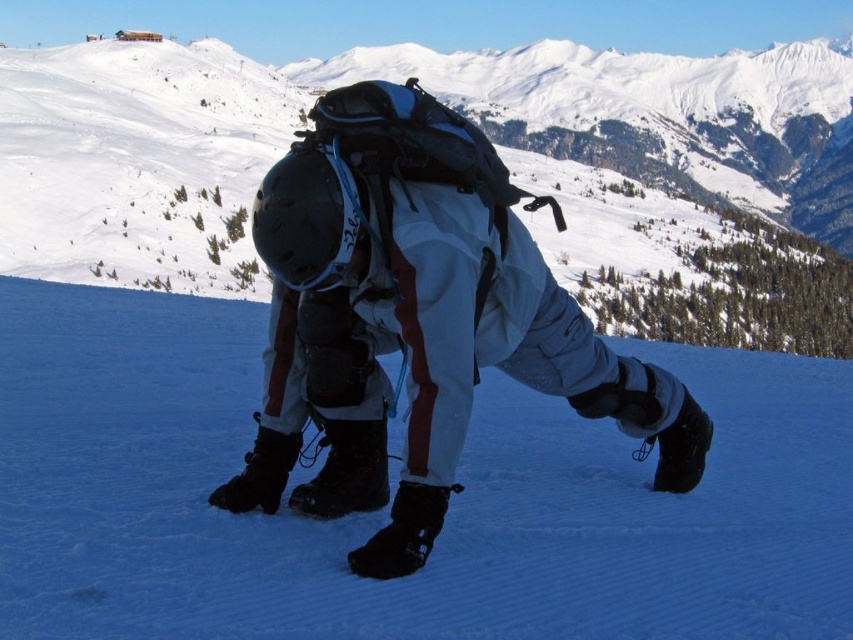
Question: Which point is farther to the camera?

Choices:
 (A) (329, 483)
 (B) (320, 618)

Answer: (A)

Question: Does white matte snow at center appear on the left side of white matte snowsuit at center?

Choices:
 (A) no
 (B) yes

Answer: (B)

Question: Is white matte snow at center wider than white matte snowsuit at center?

Choices:
 (A) no
 (B) yes

Answer: (B)

Question: Can you confirm if white matte snow at center is smaller than white matte snowsuit at center?

Choices:
 (A) yes
 (B) no

Answer: (A)